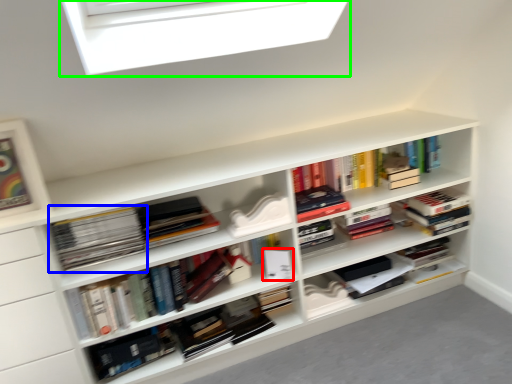
Question: Which object is the farthest from paperback book (highlighted by a red box)? Choose among these: book (highlighted by a blue box) or window (highlighted by a green box).

Choices:
 (A) book
 (B) window

Answer: (B)